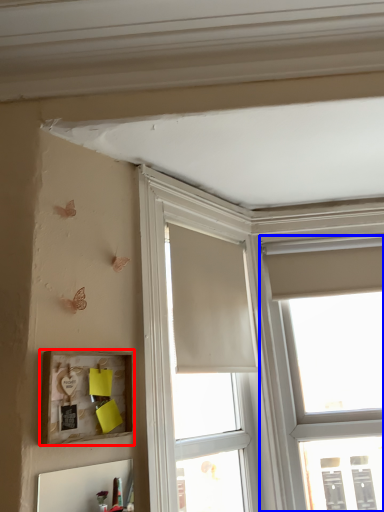
Question: Which of the following is the closest to the observer, picture frame (highlighted by a red box) or window (highlighted by a blue box)?

Choices:
 (A) picture frame
 (B) window

Answer: (A)